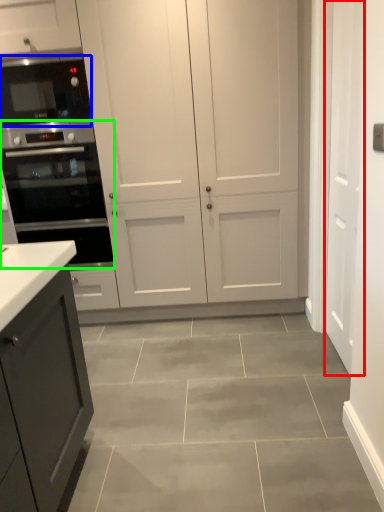
Question: Estimate the real-world distances between objects in this image. Which object is farther from door (highlighted by a red box), microwave oven (highlighted by a blue box) or oven (highlighted by a green box)?

Choices:
 (A) microwave oven
 (B) oven

Answer: (A)